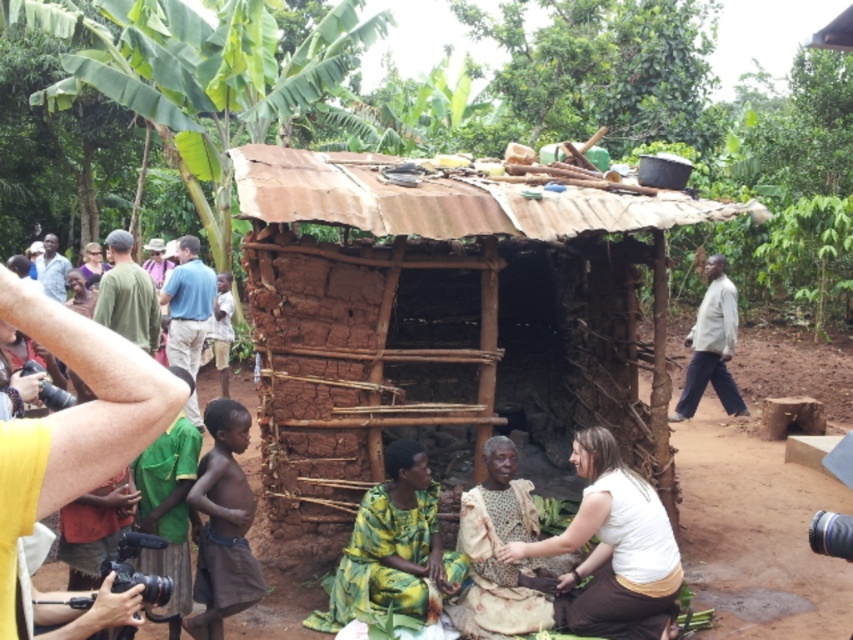
Is yellow-green fabric at center taller than white cotton shirt at right?

No, yellow-green fabric at center is not taller than white cotton shirt at right.

Between yellow-green fabric at center and white cotton shirt at right, which one appears on the left side from the viewer's perspective?

Positioned to the left is yellow-green fabric at center.

Measure the distance between yellow-green fabric at center and camera.

yellow-green fabric at center and camera are 5.17 meters apart.

The width and height of the screenshot is (853, 640). In order to click on yellow-green fabric at center in this screenshot , I will do `click(393, 548)`.

Does point (494, 305) lie behind point (126, 250)?

No, it is not.

Who is more distant from viewer, (573, 212) or (135, 323)?

Point (135, 323)

Does point (548, 308) come closer to viewer compared to point (132, 310)?

That is False.

This screenshot has width=853, height=640. What are the coordinates of `brown mud hut at center` in the screenshot? It's located at (442, 321).

Find the location of a particular element. white cotton shirt at center is located at coordinates (613, 548).

Who is taller, white cotton shirt at center or brown cloth at lower left?

With more height is brown cloth at lower left.

Does point (576, 532) lie in front of point (231, 442)?

That is False.

I want to click on white cotton shirt at center, so click(613, 548).